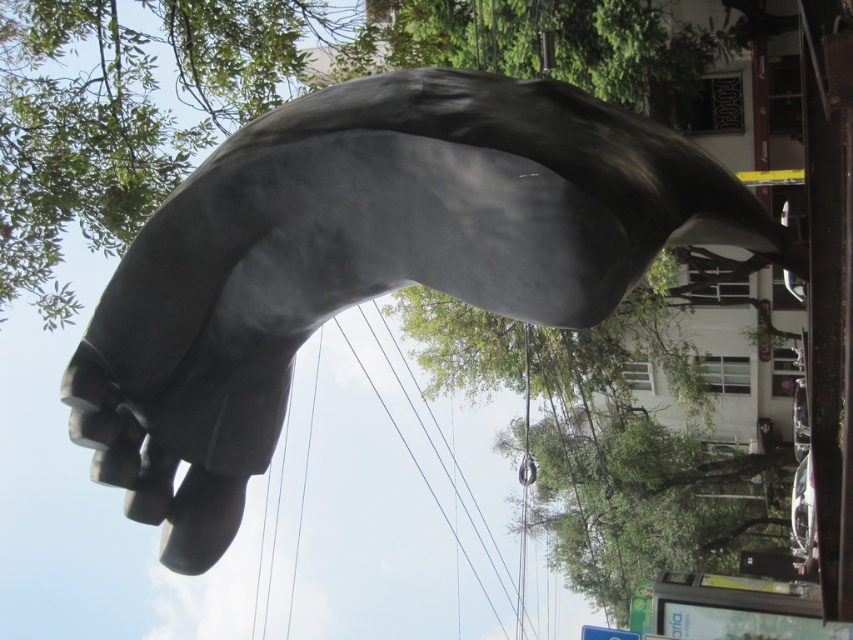
Is satin gray hand at center positioned in front of green leafy tree at center?

Yes, satin gray hand at center is closer to the viewer.

Which of these two, satin gray hand at center or green leafy tree at center, stands shorter?

With less height is green leafy tree at center.

Where is `satin gray hand at center`? satin gray hand at center is located at coordinates (368, 260).

Locate an element on the screen. The image size is (853, 640). satin gray hand at center is located at coordinates (368, 260).